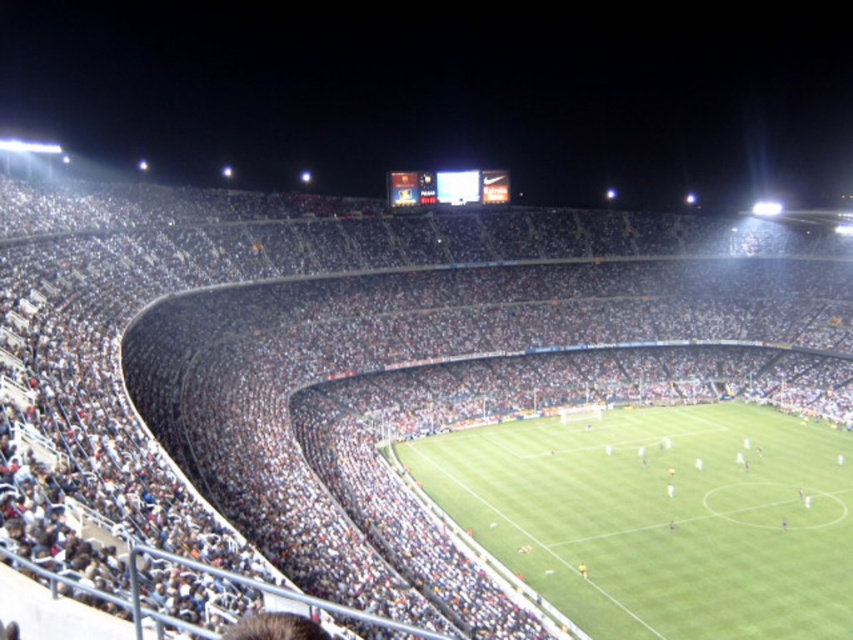
You are a drone operator trying to capture a live soccer match. Your drone is currently hovering above the dark gray concrete seats at center. You want to fly it down to the green grass football field at center to get a better shot. Is the drone able to descend vertically without hitting any obstacles?

The dark gray concrete seats at center are much taller than the green grass football field at center, so the drone can descend vertically from the seats to the field without hitting obstacles since the seats are elevated above the field.

You are standing at the point marked as point (345, 342) in the stadium. What surface are you currently standing on?

You are standing on dark gray concrete seats at center.